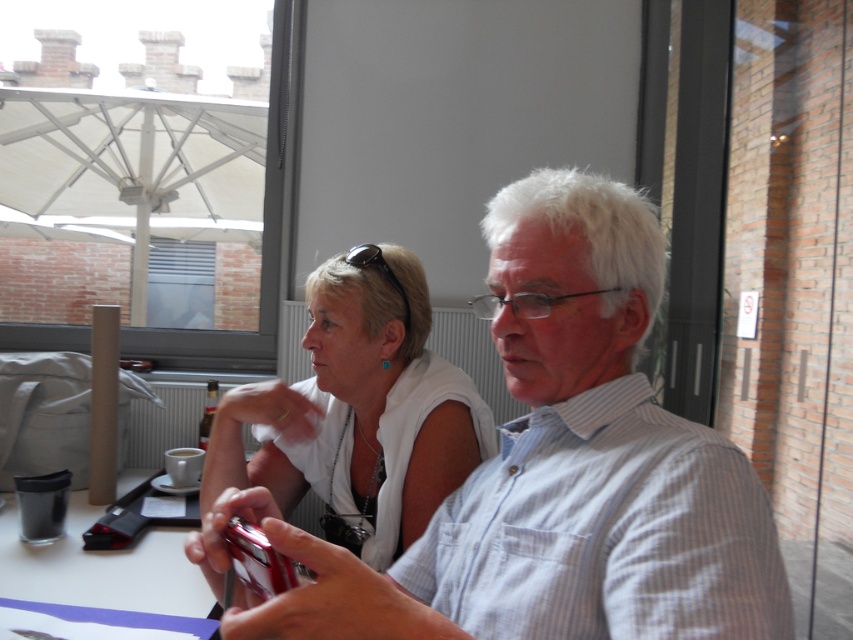
In the scene shown: You are a waiter at a restaurant and need to place a new drink order on the table. The table has a white fabric shirt at center and a clear plastic cup at lower left. Where should you place the new drink to avoid covering any items?

The white fabric shirt at center is positioned on the right side of clear plastic cup at lower left, so placing the new drink on the left side of the clear plastic cup at lower left would avoid covering any items.

You are a photographer standing in front of the scene. You want to take a closeup photo of the white fabric shirt at center. What is the minimum distance you need to move forward to get the shirt into focus?

The white fabric shirt at center is 1.22 meters from viewer. To take a closeup photo, you need to move forward until the distance between you and the shirt is within your camera lens focus range. However, since the current distance is 1.22 meters, you must move closer than that to ensure the shirt is in focus.

You are a photographer trying to capture a closeup shot of the black cup with a lid on the table. You can only focus on one point at a time. Which point should you choose to ensure the black cup with a lid is in focus? Please select between point (x=599, y=326) and point (x=346, y=276).

You should choose point (x=599, y=326) because it is closer to the camera than point (x=346, y=276), so focusing on this point will ensure the black cup with a lid is in focus.